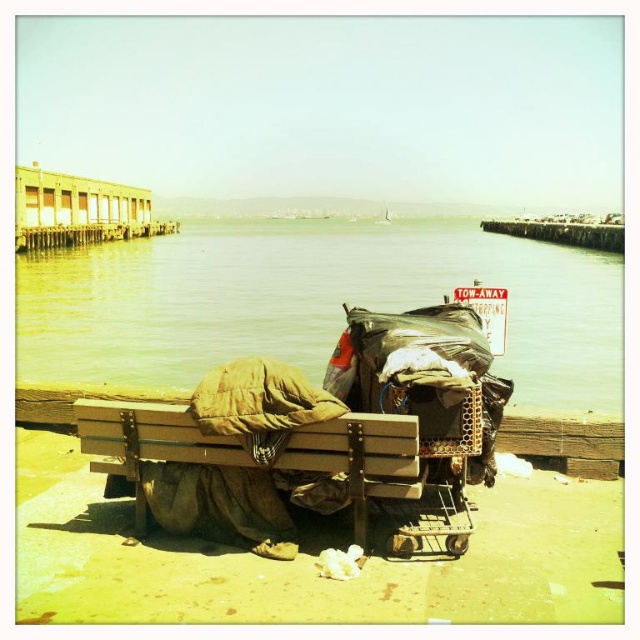
Question: Does clear water at bench left have a greater width compared to brown wooden bench at lower center?

Choices:
 (A) yes
 (B) no

Answer: (A)

Question: In this image, where is clear water at bench left located relative to brown wooden bench at lower center?

Choices:
 (A) above
 (B) below

Answer: (A)

Question: Which point is closer to the camera?

Choices:
 (A) (99, 451)
 (B) (365, 260)

Answer: (A)

Question: Which object is farther from the camera taking this photo?

Choices:
 (A) clear water at bench left
 (B) brown wooden bench at lower center

Answer: (A)

Question: Does clear water at bench left lie in front of brown wooden bench at lower center?

Choices:
 (A) no
 (B) yes

Answer: (A)